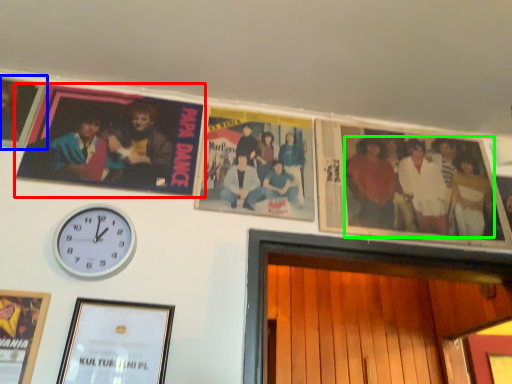
Question: Which is farther away from picture frame (highlighted by a red box)? picture frame (highlighted by a blue box) or person (highlighted by a green box)?

Choices:
 (A) picture frame
 (B) person

Answer: (B)